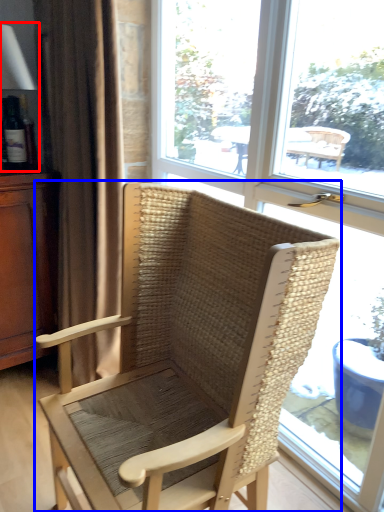
Question: Which object is closer to the camera taking this photo, table lamp (highlighted by a red box) or chair (highlighted by a blue box)?

Choices:
 (A) table lamp
 (B) chair

Answer: (B)